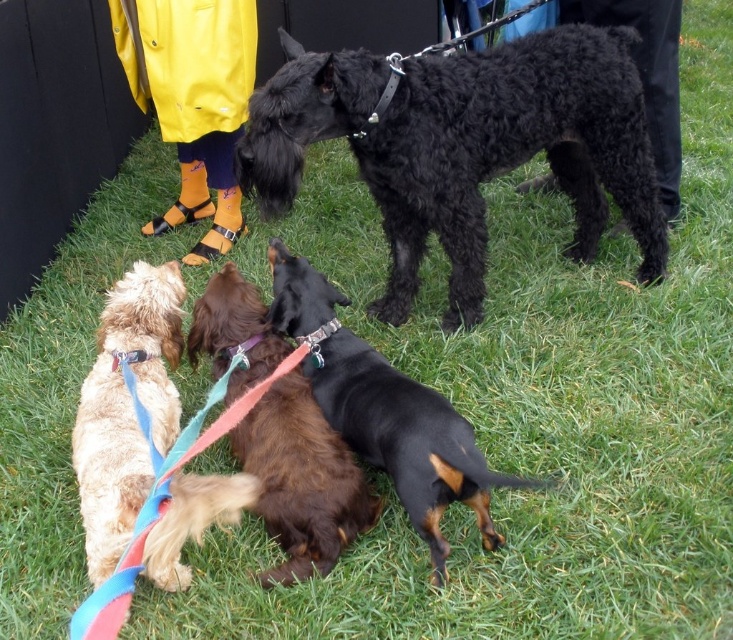
Who is more forward, (232,483) or (356,516)?

Point (232,483) is in front.

Looking at this image, can you confirm if shiny golden fur at lower left is positioned to the right of brown fuzzy dog at center?

In fact, shiny golden fur at lower left is to the left of brown fuzzy dog at center.

Which is in front, point (158, 356) or point (314, 516)?

Positioned in front is point (314, 516).

Where is `shiny golden fur at lower left`? shiny golden fur at lower left is located at coordinates (125, 408).

Who is positioned more to the left, black curly fur dog at upper center or shiny golden fur at lower left?

Positioned to the left is shiny golden fur at lower left.

Which is below, black curly fur dog at upper center or shiny golden fur at lower left?

shiny golden fur at lower left is lower down.

From the picture: Who is more forward, (x=388, y=113) or (x=174, y=344)?

Positioned in front is point (x=174, y=344).

Where is `black curly fur dog at upper center`? black curly fur dog at upper center is located at coordinates (464, 145).

Measure the distance between shiny golden fur at lower left and brown shaggy dog at center.

The distance of shiny golden fur at lower left from brown shaggy dog at center is 22.00 inches.

Who is positioned more to the left, shiny golden fur at lower left or brown shaggy dog at center?

Positioned to the left is shiny golden fur at lower left.

The width and height of the screenshot is (733, 640). What do you see at coordinates (125, 408) in the screenshot? I see `shiny golden fur at lower left` at bounding box center [125, 408].

You are a GUI agent. You are given a task and a screenshot of the screen. Output one action in this format:
    pyautogui.click(x=<x>, y=<y>)
    Task: Click on the shiny golden fur at lower left
    This screenshot has width=733, height=640.
    Given the screenshot: What is the action you would take?
    pyautogui.click(x=125, y=408)